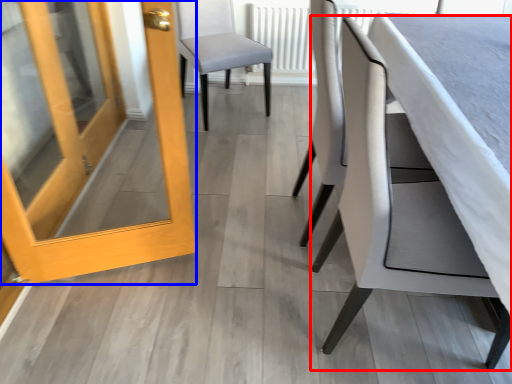
Question: Which of the following is the farthest to the observer, chair (highlighted by a red box) or door (highlighted by a blue box)?

Choices:
 (A) chair
 (B) door

Answer: (B)